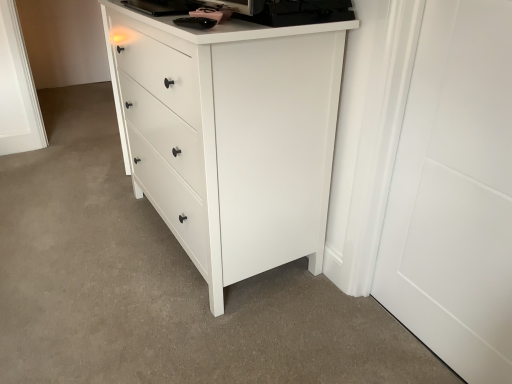
Question: From the image's perspective, is white matte chest of drawers at center positioned above or below white matte door at right?

Choices:
 (A) below
 (B) above

Answer: (B)

Question: Considering the positions of white matte chest of drawers at center and white matte door at right in the image, is white matte chest of drawers at center taller or shorter than white matte door at right?

Choices:
 (A) tall
 (B) short

Answer: (B)

Question: Choose the correct answer: Is white matte chest of drawers at center inside white matte door at right or outside it?

Choices:
 (A) inside
 (B) outside

Answer: (B)

Question: Would you say white matte door at right is to the left or to the right of white matte chest of drawers at center in the picture?

Choices:
 (A) left
 (B) right

Answer: (B)

Question: Is white matte door at right bigger or smaller than white matte chest of drawers at center?

Choices:
 (A) small
 (B) big

Answer: (A)

Question: Considering the positions of point (429, 94) and point (245, 264), is point (429, 94) closer or farther from the camera than point (245, 264)?

Choices:
 (A) closer
 (B) farther

Answer: (A)

Question: From the image's perspective, is white matte door at right above or below white matte chest of drawers at center?

Choices:
 (A) above
 (B) below

Answer: (B)